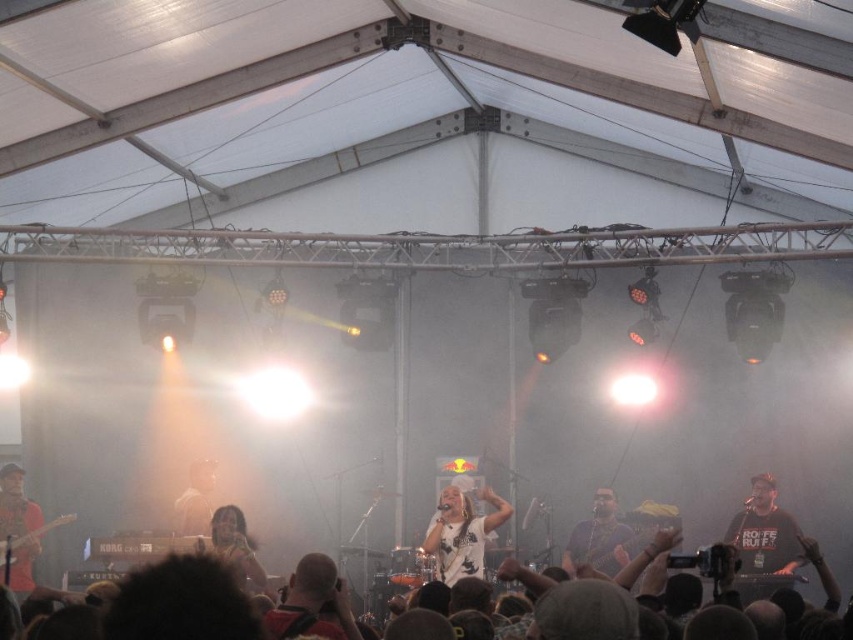
What do you see at coordinates (462, 532) in the screenshot? This screenshot has height=640, width=853. I see `white fabric shirt at center` at bounding box center [462, 532].

Can you confirm if white fabric shirt at center is positioned to the right of matte black guitar at left?

Indeed, white fabric shirt at center is positioned on the right side of matte black guitar at left.

Locate an element on the screen. The image size is (853, 640). white fabric shirt at center is located at coordinates (462, 532).

This screenshot has width=853, height=640. Find the location of `white fabric shirt at center`. white fabric shirt at center is located at coordinates (462, 532).

Is shiny black shirt at center taller than matte brown shirt at center?

In fact, shiny black shirt at center may be shorter than matte brown shirt at center.

Which is behind, point (328, 624) or point (181, 512)?

The point (181, 512) is more distant.

Locate an element on the screen. shiny black shirt at center is located at coordinates (311, 604).

Can you confirm if shiny black shirt at center is positioned above matte black guitar at left?

Indeed, shiny black shirt at center is positioned over matte black guitar at left.

Between point (337, 596) and point (28, 500), which one is positioned in front?

Positioned in front is point (337, 596).

In order to click on shiny black shirt at center in this screenshot , I will do `click(311, 604)`.